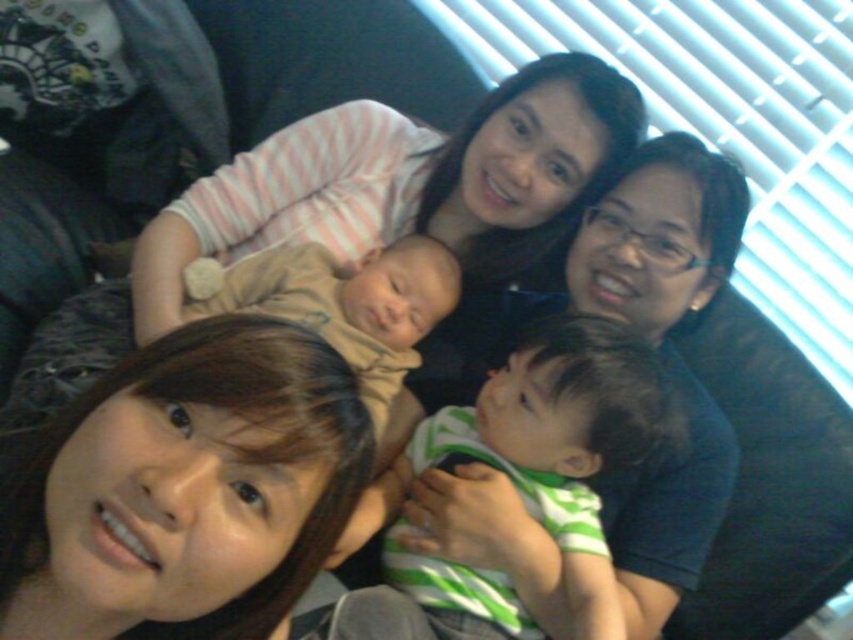
Does point (154, 566) come closer to viewer compared to point (206, 285)?

Yes, point (154, 566) is closer to viewer.

Who is higher up, brown hair at lower left or soft beige fabric baby at center?

soft beige fabric baby at center

Describe the element at coordinates (193, 483) in the screenshot. I see `brown hair at lower left` at that location.

The image size is (853, 640). Identify the location of brown hair at lower left. (193, 483).

Is green striped shirt at center taller than soft beige fabric baby at center?

Yes, green striped shirt at center is taller than soft beige fabric baby at center.

The height and width of the screenshot is (640, 853). What do you see at coordinates (561, 440) in the screenshot?
I see `green striped shirt at center` at bounding box center [561, 440].

What do you see at coordinates (561, 440) in the screenshot?
I see `green striped shirt at center` at bounding box center [561, 440].

You are a GUI agent. You are given a task and a screenshot of the screen. Output one action in this format:
    pyautogui.click(x=<x>, y=<y>)
    Task: Click on the green striped shirt at center
    This screenshot has height=640, width=853.
    Given the screenshot: What is the action you would take?
    pyautogui.click(x=561, y=440)

How distant is brown hair at lower left from green striped shirt at center?

brown hair at lower left and green striped shirt at center are 21.47 inches apart from each other.

Can you confirm if brown hair at lower left is wider than green striped shirt at center?

Incorrect, brown hair at lower left's width does not surpass green striped shirt at center's.

Locate an element on the screen. brown hair at lower left is located at coordinates (193, 483).